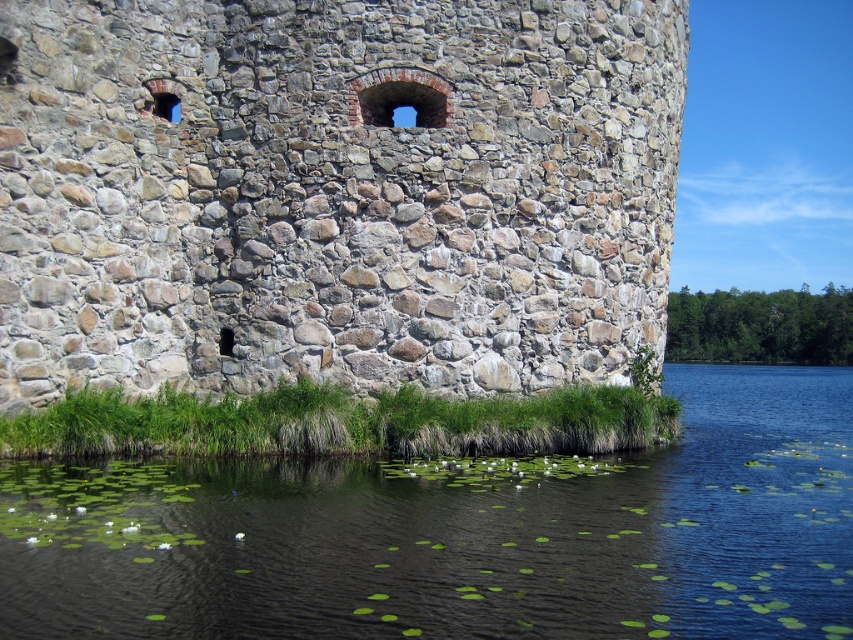
Does natural stone wall at center come behind green leafy pond at lower left?

Yes, it is.

Between natural stone wall at center and green leafy pond at lower left, which one is positioned lower?

green leafy pond at lower left is lower down.

The width and height of the screenshot is (853, 640). I want to click on natural stone wall at center, so coord(334,193).

Is green leafy pond at lower left further to camera compared to green grass at lower center?

No, green leafy pond at lower left is in front of green grass at lower center.

Between green leafy pond at lower left and green grass at lower center, which one is positioned higher?

green grass at lower center is higher up.

The width and height of the screenshot is (853, 640). In order to click on green leafy pond at lower left in this screenshot , I will do `click(460, 534)`.

The width and height of the screenshot is (853, 640). Find the location of `green leafy pond at lower left`. green leafy pond at lower left is located at coordinates (460, 534).

Does natural stone wall at center have a greater width compared to green grass at lower center?

Yes.

You are a GUI agent. You are given a task and a screenshot of the screen. Output one action in this format:
    pyautogui.click(x=<x>, y=<y>)
    Task: Click on the natural stone wall at center
    Image resolution: width=853 pixels, height=640 pixels.
    Given the screenshot: What is the action you would take?
    pyautogui.click(x=334, y=193)

In order to click on natural stone wall at center in this screenshot , I will do (x=334, y=193).